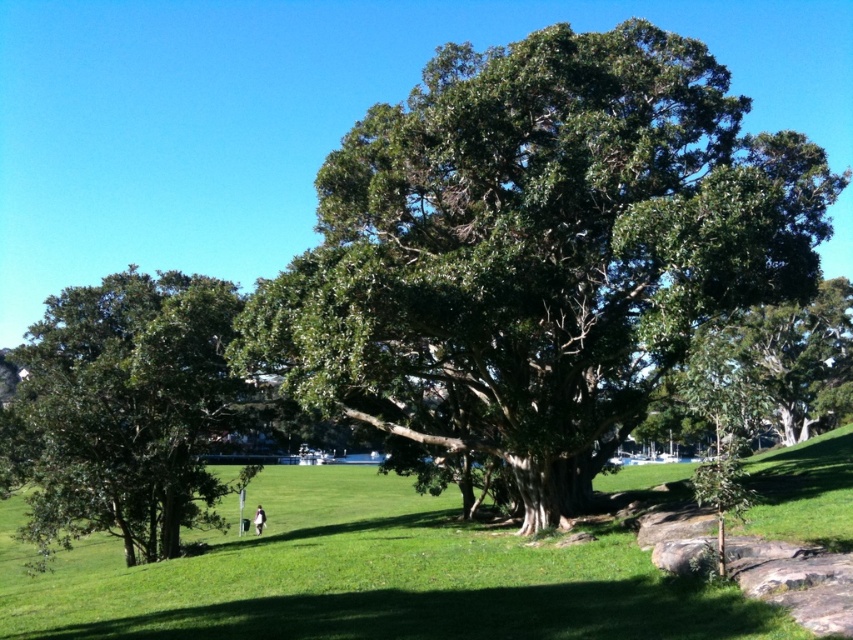
You are standing at the edge of the grassy area and see the green leafy oak tree at center and the white fabric bag at lower center. Which object is higher from the ground?

The green leafy oak tree at center is above the white fabric bag at lower center, so the green leafy oak tree at center is higher from the ground.

Based on the photo, you are standing at the camera position looking at the scene. There are two points marked in the image, point 1 at coordinates point 1 at point (323, 529) and point 2 at point (256, 515). Which point is closer to you?

Point 1 at point (323, 529) is closer to you than point 2 at point (256, 515).

You are planning to place a picnic blanket between the green leafy oak tree at center and the green glossy tree at left. The picnic blanket requires 8 meters of space. Can you fit it between them?

The distance between the green leafy oak tree at center and the green glossy tree at left is 9.16 meters, which is more than enough to accommodate the picnic blanket requiring 8 meters of space.